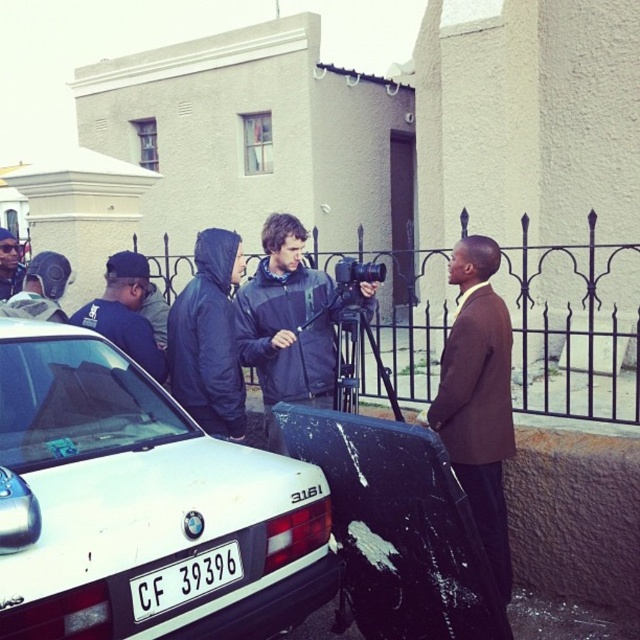
Question: Where is dark blue jacket at center located in relation to matte black helmet at left in the image?

Choices:
 (A) below
 (B) above

Answer: (A)

Question: Which object is positioned farthest from the dark blue hoodie at left?

Choices:
 (A) brown matte suit at right
 (B) white matte car at lower left
 (C) matte black helmet at left

Answer: (A)

Question: Estimate the real-world distances between objects in this image. Which object is farther from the dark blue jacket at center?

Choices:
 (A) white matte car at lower left
 (B) dark blue hoodie at left

Answer: (A)

Question: Is dark blue jacket at center positioned behind dark blue hoodie at left?

Choices:
 (A) no
 (B) yes

Answer: (A)

Question: Estimate the real-world distances between objects in this image. Which object is closer to the brown matte suit at right?

Choices:
 (A) white plastic license plate at lower center
 (B) matte black helmet at left

Answer: (A)

Question: Does white plastic license plate at lower center appear on the right side of matte black helmet at left?

Choices:
 (A) yes
 (B) no

Answer: (A)